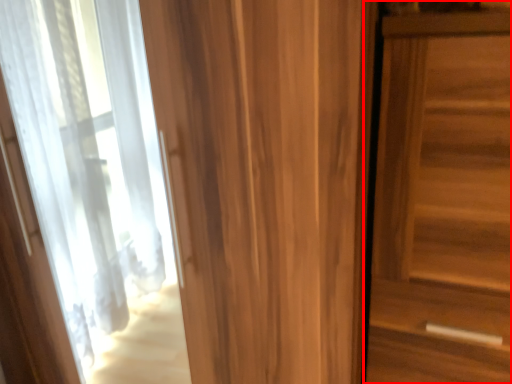
Question: From the image's perspective, what is the correct spatial relationship of door (annotated by the red box) in relation to door?

Choices:
 (A) below
 (B) above

Answer: (A)